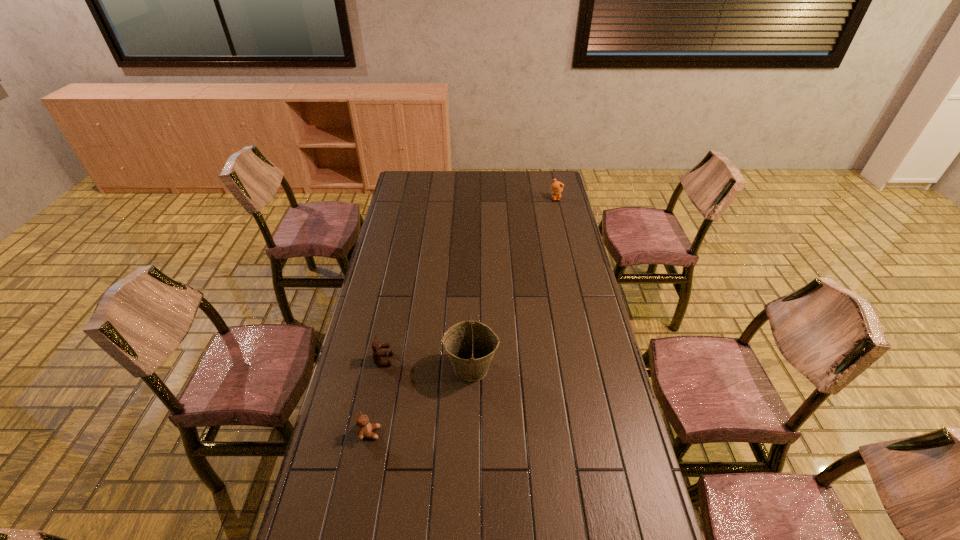
This screenshot has height=540, width=960. What are the coordinates of `object positioned at the right edge` in the screenshot? It's located at (557, 187).

You are a GUI agent. You are given a task and a screenshot of the screen. Output one action in this format:
    pyautogui.click(x=<x>, y=<y>)
    Task: Click on the vacant area at the far edge
    The width and height of the screenshot is (960, 540).
    Given the screenshot: What is the action you would take?
    pyautogui.click(x=496, y=193)

This screenshot has width=960, height=540. What are the coordinates of `vacant space at the left edge of the desktop` in the screenshot? It's located at (362, 443).

In the image, there is a desktop. At what (x,y) coordinates should I click in order to perform the action: click on vacant space at the right edge. Please return your answer as a coordinate pair (x, y). This screenshot has height=540, width=960. Looking at the image, I should click on (539, 214).

Where is `vacant space at the far left corner of the desktop`? vacant space at the far left corner of the desktop is located at coordinates tap(401, 176).

At what (x,y) coordinates should I click in order to perform the action: click on empty space between the farthest teddy bear and the nearest object. Please return your answer as a coordinate pair (x, y). The height and width of the screenshot is (540, 960). Looking at the image, I should click on 463,316.

Find the location of a particular element. This screenshot has width=960, height=540. free area in between the second nearest teddy bear and the farthest teddy bear is located at coordinates (469, 279).

Locate an element on the screen. free space between the rightmost teddy bear and the tallest object is located at coordinates (514, 283).

This screenshot has height=540, width=960. I want to click on vacant space in between the rightmost teddy bear and the wine bucket, so click(x=514, y=283).

Find the location of a particular element. free point between the nearest teddy bear and the farthest teddy bear is located at coordinates (463, 316).